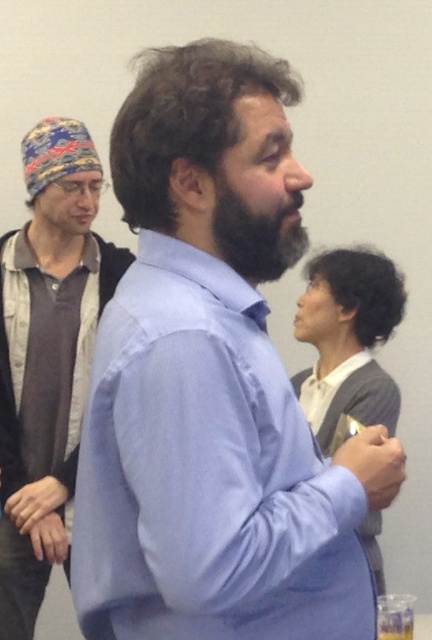
Is matte blue shirt at center thinner than dark brown fuzzy beard at center?

In fact, matte blue shirt at center might be wider than dark brown fuzzy beard at center.

Between matte blue shirt at center and dark brown fuzzy beard at center, which one is positioned lower?

Positioned lower is matte blue shirt at center.

Which is behind, point (89, 170) or point (279, 253)?

Point (89, 170)

Locate an element on the screen. The image size is (432, 640). matte blue shirt at center is located at coordinates (47, 356).

Does light blue shirt at center appear under matte blue shirt at center?

Actually, light blue shirt at center is above matte blue shirt at center.

From the picture: Between light blue shirt at center and matte blue shirt at center, which one appears on the right side from the viewer's perspective?

Positioned to the right is light blue shirt at center.

Where is `light blue shirt at center`? This screenshot has width=432, height=640. light blue shirt at center is located at coordinates (213, 384).

Can you confirm if light blue shirt at center is positioned to the left of dark brown fuzzy beard at center?

Indeed, light blue shirt at center is positioned on the left side of dark brown fuzzy beard at center.

Who is taller, light blue shirt at center or dark brown fuzzy beard at center?

light blue shirt at center

Where is `light blue shirt at center`? This screenshot has width=432, height=640. light blue shirt at center is located at coordinates tap(213, 384).